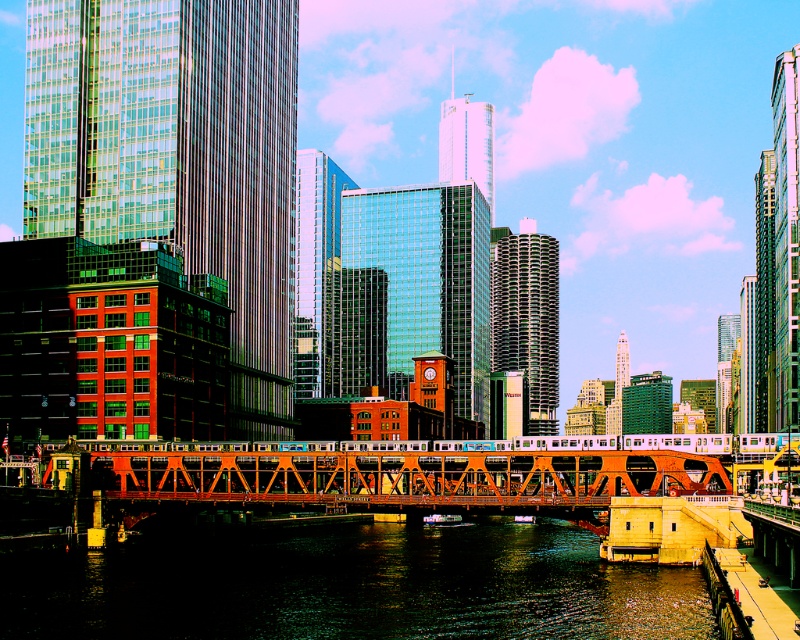
You are standing at the base of the orange steel bridge and want to take a photo that includes both the point at coordinates point (278, 552) and point (438, 488). Which point should you focus on to ensure both are in sharp focus?

You should focus on point (278, 552) because it is closer to the camera than point (438, 488). By focusing on the closer point, the depth of field will likely include the farther point as well, ensuring both are in sharp focus.

You are a city planner evaluating the space between the dark reflective water at center and the orange metallic bridge at center. If the city wants to install a new pedestrian walkway that is 10 meters wide between them, will there be enough space?

The dark reflective water at center has a width less than the orange metallic bridge at center. Since the walkway requires 10 meters, but the space between them is narrower than the bridge itself, it might not be sufficient. However, without exact measurements, we can infer the water is narrower, so the space might be insufficient for a 10m walkway.